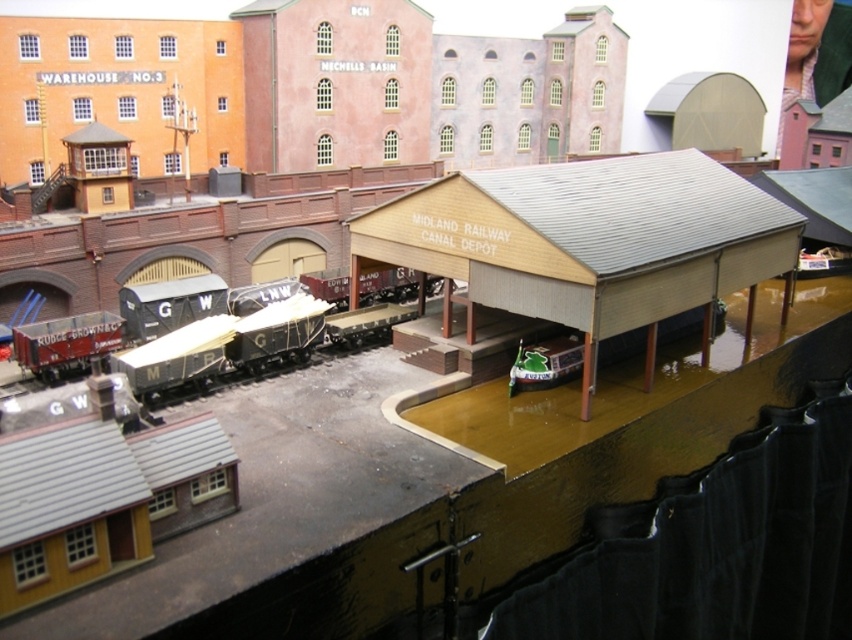
Question: Is matte black train car at center in front of green plastic boat at lower center?

Choices:
 (A) no
 (B) yes

Answer: (B)

Question: Does wooden/metal roofed shed at center appear over matte black train car at center?

Choices:
 (A) no
 (B) yes

Answer: (B)

Question: From the image, what is the correct spatial relationship of wooden/metal roofed shed at center in relation to matte black train car at center?

Choices:
 (A) above
 (B) below

Answer: (A)

Question: Estimate the real-world distances between objects in this image. Which object is closer to the wooden/metal roofed shed at center?

Choices:
 (A) matte black train car at center
 (B) green plastic boat at lower center

Answer: (B)

Question: Which point appears farthest from the camera in this image?

Choices:
 (A) (118, 346)
 (B) (563, 241)

Answer: (A)

Question: Which object appears closest to the camera in this image?

Choices:
 (A) wooden/metal roofed shed at center
 (B) matte black train car at center
 (C) green plastic boat at lower center

Answer: (B)